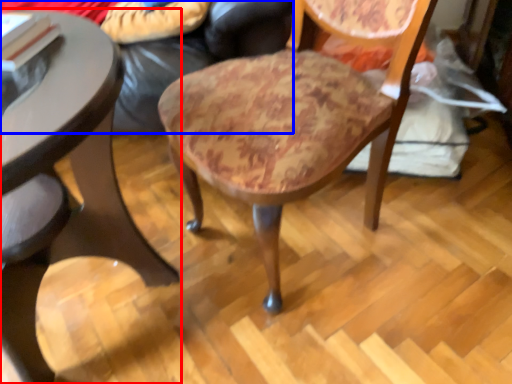
Question: Which object is further to the camera taking this photo, table (highlighted by a red box) or couch (highlighted by a blue box)?

Choices:
 (A) table
 (B) couch

Answer: (B)